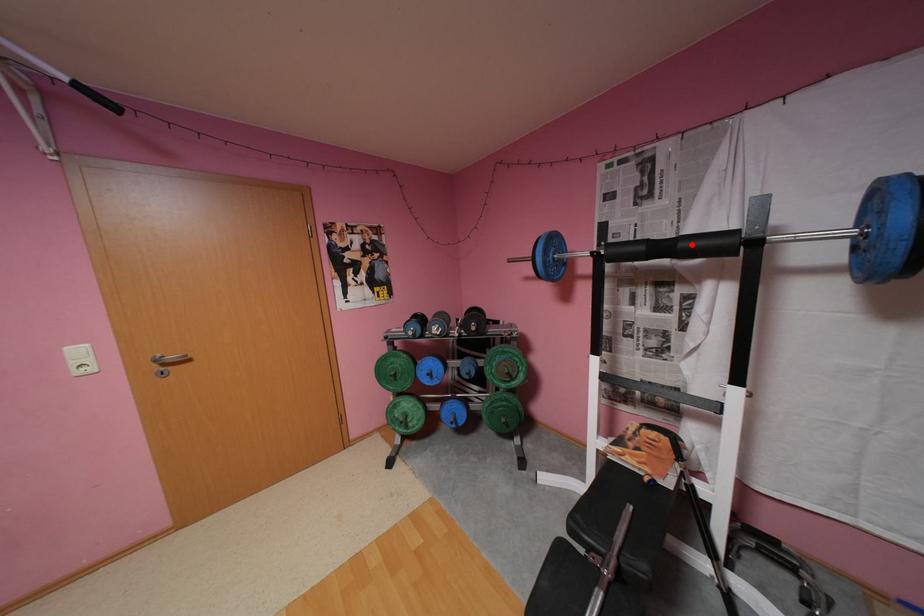
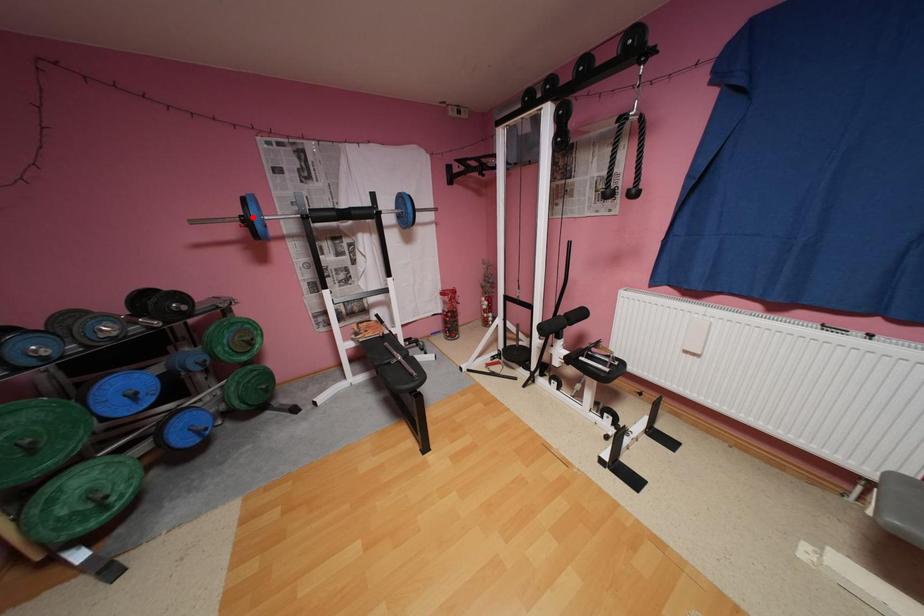
I am providing you with two images of the same scene from different viewpoints. A red point is marked on the first image and another point is marked on the second image. Are the points marked in image1 and image2 representing the same 3D position?

No